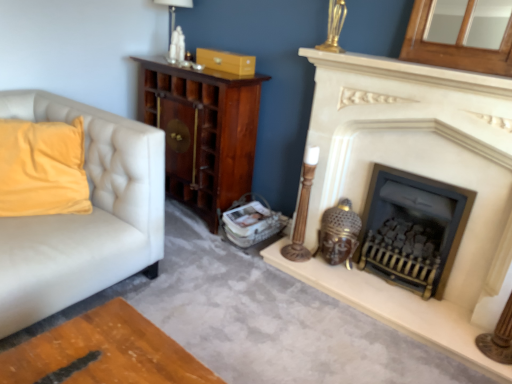
Question: Is black cast iron wood burning stove at center bigger than matte white fireplace at right?

Choices:
 (A) yes
 (B) no

Answer: (B)

Question: From a real-world perspective, does black cast iron wood burning stove at center stand above matte white fireplace at right?

Choices:
 (A) no
 (B) yes

Answer: (A)

Question: Does black cast iron wood burning stove at center lie in front of matte white fireplace at right?

Choices:
 (A) no
 (B) yes

Answer: (A)

Question: Can you confirm if black cast iron wood burning stove at center is positioned to the right of matte white fireplace at right?

Choices:
 (A) yes
 (B) no

Answer: (A)

Question: Is black cast iron wood burning stove at center oriented towards matte white fireplace at right?

Choices:
 (A) yes
 (B) no

Answer: (A)

Question: Is black cast iron wood burning stove at center in front of or behind matte white fireplace at right in the image?

Choices:
 (A) front
 (B) behind

Answer: (B)

Question: Do you think black cast iron wood burning stove at center is within matte white fireplace at right, or outside of it?

Choices:
 (A) outside
 (B) inside

Answer: (B)

Question: Based on their sizes in the image, would you say black cast iron wood burning stove at center is bigger or smaller than matte white fireplace at right?

Choices:
 (A) small
 (B) big

Answer: (A)

Question: From a real-world perspective, is black cast iron wood burning stove at center above or below matte white fireplace at right?

Choices:
 (A) below
 (B) above

Answer: (A)

Question: From the image's perspective, relative to black cast iron wood burning stove at center, is matte wood drawer at upper center above or below?

Choices:
 (A) above
 (B) below

Answer: (A)

Question: Considering the positions of point (222, 66) and point (396, 201), is point (222, 66) closer or farther from the camera than point (396, 201)?

Choices:
 (A) farther
 (B) closer

Answer: (A)

Question: In the image, is matte wood drawer at upper center on the left side or the right side of black cast iron wood burning stove at center?

Choices:
 (A) right
 (B) left

Answer: (B)

Question: From a real-world perspective, relative to black cast iron wood burning stove at center, is matte wood drawer at upper center vertically above or below?

Choices:
 (A) above
 (B) below

Answer: (A)

Question: Is black cast iron wood burning stove at center in front of or behind matte wood drawer at upper center in the image?

Choices:
 (A) front
 (B) behind

Answer: (A)

Question: From the image's perspective, is black cast iron wood burning stove at center above or below matte wood drawer at upper center?

Choices:
 (A) above
 (B) below

Answer: (B)